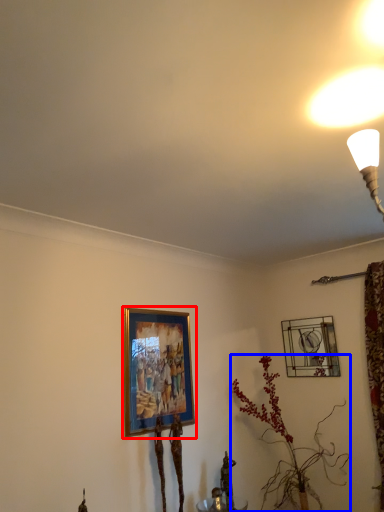
Question: Which of the following is the farthest to the observer, picture frame (highlighted by a red box) or houseplant (highlighted by a blue box)?

Choices:
 (A) picture frame
 (B) houseplant

Answer: (B)